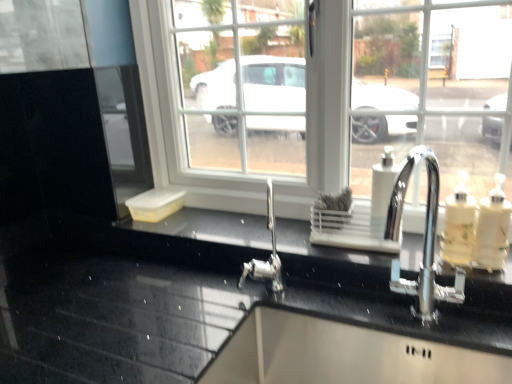
The width and height of the screenshot is (512, 384). I want to click on black glossy countertop at center, so click(x=210, y=228).

Locate an element on the screen. Image resolution: width=512 pixels, height=384 pixels. white glossy soap dispenser at right, acting as the 1th soap dispenser starting from the right is located at coordinates (493, 228).

Locate an element on the screen. white plastic soap dispenser at center-right, arranged as the 1th soap dispenser when viewed from the left is located at coordinates (382, 190).

Is translucent plastic soap dispenser at right, positioned as the 2th soap dispenser in left-to-right order, at the right side of white glossy soap dispenser at right, acting as the 1th soap dispenser starting from the right?

Incorrect, translucent plastic soap dispenser at right, positioned as the 2th soap dispenser in left-to-right order, is not on the right side of white glossy soap dispenser at right, acting as the 1th soap dispenser starting from the right.

From the image's perspective, which one is positioned lower, translucent plastic soap dispenser at right, positioned as the 2th soap dispenser in right-to-left order, or white glossy soap dispenser at right, positioned as the 3th soap dispenser in left-to-right order?

white glossy soap dispenser at right, positioned as the 3th soap dispenser in left-to-right order, from the image's perspective.

From a real-world perspective, is translucent plastic soap dispenser at right, positioned as the 2th soap dispenser in left-to-right order, on white glossy soap dispenser at right, positioned as the 3th soap dispenser in left-to-right order?

Actually, translucent plastic soap dispenser at right, positioned as the 2th soap dispenser in left-to-right order, is physically below white glossy soap dispenser at right, positioned as the 3th soap dispenser in left-to-right order, in the real world.

Which is more to the left, black glossy countertop at center or white plastic soap dispenser at center-right, marked as the third soap dispenser in a right-to-left arrangement?

black glossy countertop at center is more to the left.

From a real-world perspective, count 3rd soap dispensers upward from the black glossy countertop at center and point to it. Please provide its 2D coordinates.

[(382, 190)]

From a real-world perspective, is black glossy countertop at center located beneath white plastic soap dispenser at center-right, arranged as the 1th soap dispenser when viewed from the left?

Yes, from a real-world perspective, black glossy countertop at center is under white plastic soap dispenser at center-right, arranged as the 1th soap dispenser when viewed from the left.

In terms of width, does black glossy countertop at center look wider or thinner when compared to white plastic soap dispenser at center-right, marked as the third soap dispenser in a right-to-left arrangement?

black glossy countertop at center is wider than white plastic soap dispenser at center-right, marked as the third soap dispenser in a right-to-left arrangement.

Are white glossy soap dispenser at right, positioned as the 3th soap dispenser in left-to-right order, and black glossy countertop at center beside each other?

There is a gap between white glossy soap dispenser at right, positioned as the 3th soap dispenser in left-to-right order, and black glossy countertop at center.

Is white glossy soap dispenser at right, acting as the 1th soap dispenser starting from the right, looking in the opposite direction of black glossy countertop at center?

white glossy soap dispenser at right, acting as the 1th soap dispenser starting from the right, is not turned away from black glossy countertop at center.

Is white glossy soap dispenser at right, positioned as the 3th soap dispenser in left-to-right order, not within black glossy countertop at center?

That's correct, white glossy soap dispenser at right, positioned as the 3th soap dispenser in left-to-right order, is outside of black glossy countertop at center.

From the image's perspective, is black glossy countertop at center on white glossy soap dispenser at right, positioned as the 3th soap dispenser in left-to-right order?

No, from the image's perspective, black glossy countertop at center is not over white glossy soap dispenser at right, positioned as the 3th soap dispenser in left-to-right order.

Would you say black glossy countertop at center is outside white glossy soap dispenser at right, positioned as the 3th soap dispenser in left-to-right order?

Indeed, black glossy countertop at center is completely outside white glossy soap dispenser at right, positioned as the 3th soap dispenser in left-to-right order.

From the picture: Is black glossy countertop at center looking in the opposite direction of white glossy soap dispenser at right, positioned as the 3th soap dispenser in left-to-right order?

That's not correct — black glossy countertop at center is not looking away from white glossy soap dispenser at right, positioned as the 3th soap dispenser in left-to-right order.

Can you confirm if black glossy countertop at center is smaller than white glossy soap dispenser at right, acting as the 1th soap dispenser starting from the right?

No.

From the image's perspective, which one is positioned higher, white plastic soap dispenser at center-right, arranged as the 1th soap dispenser when viewed from the left, or black glossy countertop at center?

From the image's view, white plastic soap dispenser at center-right, arranged as the 1th soap dispenser when viewed from the left, is above.

Would you say white plastic soap dispenser at center-right, marked as the third soap dispenser in a right-to-left arrangement, is to the left or to the right of black glossy countertop at center in the picture?

white plastic soap dispenser at center-right, marked as the third soap dispenser in a right-to-left arrangement, is to the right of black glossy countertop at center.

Is white plastic soap dispenser at center-right, marked as the third soap dispenser in a right-to-left arrangement, directly adjacent to black glossy countertop at center?

No, white plastic soap dispenser at center-right, marked as the third soap dispenser in a right-to-left arrangement, is not making contact with black glossy countertop at center.

From a real-world perspective, is white plastic soap dispenser at center-right, arranged as the 1th soap dispenser when viewed from the left, above or below white glossy soap dispenser at right, acting as the 1th soap dispenser starting from the right?

From a real-world perspective, white plastic soap dispenser at center-right, arranged as the 1th soap dispenser when viewed from the left, is physically above white glossy soap dispenser at right, acting as the 1th soap dispenser starting from the right.

Is white plastic soap dispenser at center-right, arranged as the 1th soap dispenser when viewed from the left, with white glossy soap dispenser at right, positioned as the 3th soap dispenser in left-to-right order?

They are not placed beside each other.

Does white plastic soap dispenser at center-right, marked as the third soap dispenser in a right-to-left arrangement, have a greater width compared to white glossy soap dispenser at right, positioned as the 3th soap dispenser in left-to-right order?

Incorrect, the width of white plastic soap dispenser at center-right, marked as the third soap dispenser in a right-to-left arrangement, does not surpass that of white glossy soap dispenser at right, positioned as the 3th soap dispenser in left-to-right order.

Does white plastic soap dispenser at center-right, marked as the third soap dispenser in a right-to-left arrangement, turn towards white glossy soap dispenser at right, positioned as the 3th soap dispenser in left-to-right order?

No, white plastic soap dispenser at center-right, marked as the third soap dispenser in a right-to-left arrangement, is not turned towards white glossy soap dispenser at right, positioned as the 3th soap dispenser in left-to-right order.

Is translucent plastic soap dispenser at right, positioned as the 2th soap dispenser in right-to-left order, at the back of white plastic soap dispenser at center-right, arranged as the 1th soap dispenser when viewed from the left?

No, white plastic soap dispenser at center-right, arranged as the 1th soap dispenser when viewed from the left,'s orientation is not away from translucent plastic soap dispenser at right, positioned as the 2th soap dispenser in right-to-left order.

Consider the image. Which of these two, white plastic soap dispenser at center-right, marked as the third soap dispenser in a right-to-left arrangement, or translucent plastic soap dispenser at right, positioned as the 2th soap dispenser in right-to-left order, is thinner?

With smaller width is white plastic soap dispenser at center-right, marked as the third soap dispenser in a right-to-left arrangement.

Which of these two, white plastic soap dispenser at center-right, arranged as the 1th soap dispenser when viewed from the left, or translucent plastic soap dispenser at right, positioned as the 2th soap dispenser in left-to-right order, is bigger?

translucent plastic soap dispenser at right, positioned as the 2th soap dispenser in left-to-right order, is bigger.

Is white plastic soap dispenser at center-right, marked as the third soap dispenser in a right-to-left arrangement, not near translucent plastic soap dispenser at right, positioned as the 2th soap dispenser in right-to-left order?

No.

Identify the location of soap dispenser that appears below the white glossy soap dispenser at right, acting as the 1th soap dispenser starting from the right (from a real-world perspective). (458, 225).

The height and width of the screenshot is (384, 512). I want to click on counter top in front of the white plastic soap dispenser at center-right, arranged as the 1th soap dispenser when viewed from the left, so click(210, 228).

Considering their positions, is white plastic soap dispenser at center-right, arranged as the 1th soap dispenser when viewed from the left, positioned closer to translucent plastic soap dispenser at right, positioned as the 2th soap dispenser in left-to-right order, than white glossy soap dispenser at right, acting as the 1th soap dispenser starting from the right?

Based on the image, white glossy soap dispenser at right, acting as the 1th soap dispenser starting from the right, appears to be nearer to translucent plastic soap dispenser at right, positioned as the 2th soap dispenser in left-to-right order.

Looking at the image, which one is located further to white glossy soap dispenser at right, positioned as the 3th soap dispenser in left-to-right order, white plastic soap dispenser at center-right, marked as the third soap dispenser in a right-to-left arrangement, or translucent plastic soap dispenser at right, positioned as the 2th soap dispenser in left-to-right order?

white plastic soap dispenser at center-right, marked as the third soap dispenser in a right-to-left arrangement, lies further to white glossy soap dispenser at right, positioned as the 3th soap dispenser in left-to-right order, than the other object.

Looking at the image, which one is located further to black glossy countertop at center, white plastic soap dispenser at center-right, arranged as the 1th soap dispenser when viewed from the left, or white glossy soap dispenser at right, acting as the 1th soap dispenser starting from the right?

white glossy soap dispenser at right, acting as the 1th soap dispenser starting from the right, lies further to black glossy countertop at center than the other object.

Considering their positions, is translucent plastic soap dispenser at right, positioned as the 2th soap dispenser in left-to-right order, positioned closer to white glossy soap dispenser at right, acting as the 1th soap dispenser starting from the right, than white plastic soap dispenser at center-right, arranged as the 1th soap dispenser when viewed from the left?

translucent plastic soap dispenser at right, positioned as the 2th soap dispenser in left-to-right order.

Which object lies further to the anchor point white plastic soap dispenser at center-right, marked as the third soap dispenser in a right-to-left arrangement, translucent plastic soap dispenser at right, positioned as the 2th soap dispenser in right-to-left order, or black glossy countertop at center?

black glossy countertop at center is positioned further to the anchor white plastic soap dispenser at center-right, marked as the third soap dispenser in a right-to-left arrangement.

From the image, which object appears to be nearer to white plastic soap dispenser at center-right, arranged as the 1th soap dispenser when viewed from the left, black glossy countertop at center or translucent plastic soap dispenser at right, positioned as the 2th soap dispenser in left-to-right order?

translucent plastic soap dispenser at right, positioned as the 2th soap dispenser in left-to-right order, is closer to white plastic soap dispenser at center-right, arranged as the 1th soap dispenser when viewed from the left.

When comparing their distances from translucent plastic soap dispenser at right, positioned as the 2th soap dispenser in right-to-left order, does black glossy countertop at center or white glossy soap dispenser at right, acting as the 1th soap dispenser starting from the right, seem closer?

white glossy soap dispenser at right, acting as the 1th soap dispenser starting from the right, is closer to translucent plastic soap dispenser at right, positioned as the 2th soap dispenser in right-to-left order.

Considering their positions, is white plastic soap dispenser at center-right, arranged as the 1th soap dispenser when viewed from the left, positioned further to translucent plastic soap dispenser at right, positioned as the 2th soap dispenser in right-to-left order, than black glossy countertop at center?

black glossy countertop at center is further to translucent plastic soap dispenser at right, positioned as the 2th soap dispenser in right-to-left order.

You are a GUI agent. You are given a task and a screenshot of the screen. Output one action in this format:
    pyautogui.click(x=<x>, y=<y>)
    Task: Click on the soap dispenser situated between white plastic soap dispenser at center-right, arranged as the 1th soap dispenser when viewed from the left, and white glossy soap dispenser at right, acting as the 1th soap dispenser starting from the right, from left to right
    This screenshot has height=384, width=512.
    Given the screenshot: What is the action you would take?
    pyautogui.click(x=458, y=225)

At what (x,y) coordinates should I click in order to perform the action: click on soap dispenser between black glossy countertop at center and translucent plastic soap dispenser at right, positioned as the 2th soap dispenser in right-to-left order. Please return your answer as a coordinate pair (x, y). Looking at the image, I should click on (382, 190).